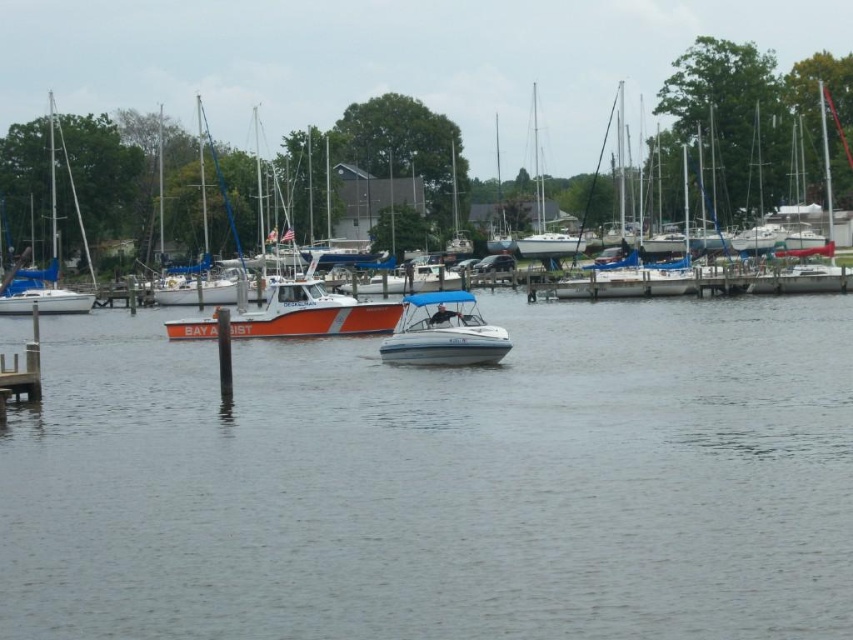
You are a photographer planning to take a photo of the white plastic boat at center and the blue sailboat at left. You want to ensure that both boats are fully visible in the frame. Given their heights, which boat might require you to adjust your camera angle to avoid cropping the top of it?

The blue sailboat at left is taller than the white plastic boat at center, so you might need to adjust your camera angle to ensure the top of the blue sailboat at left is fully visible in the photo.